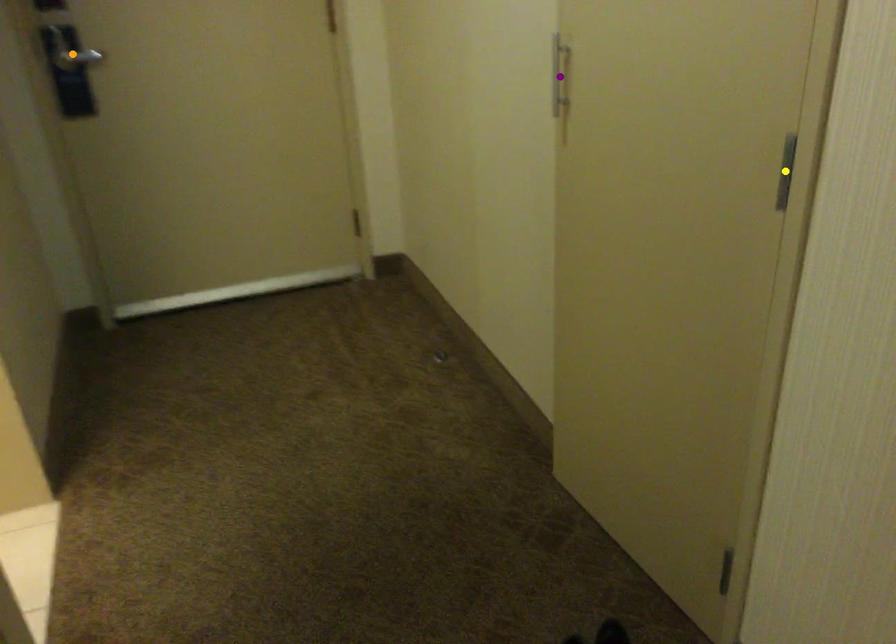
Order these from nearest to farthest:
A) purple point
B) yellow point
C) orange point

orange point → purple point → yellow point